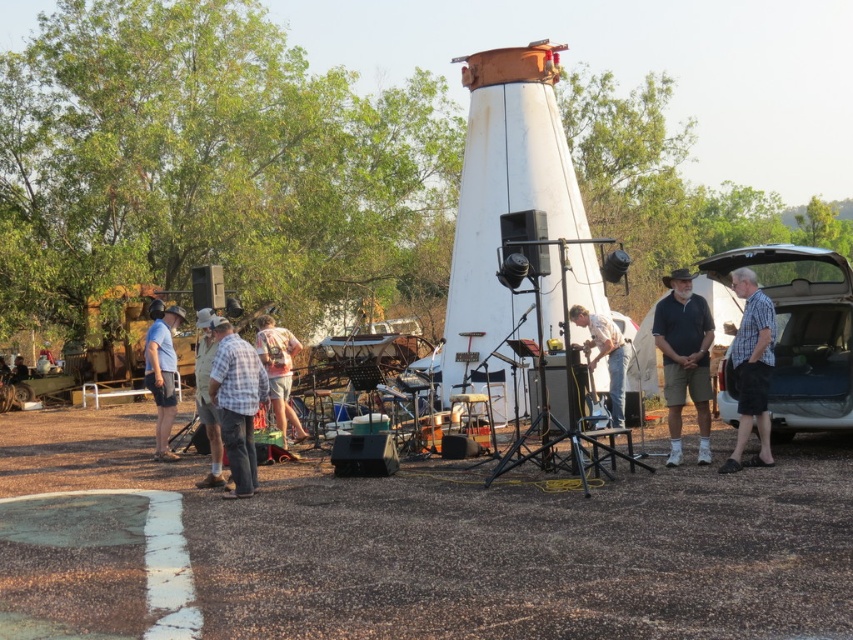
Does point (708, 360) come behind point (285, 420)?

No, it is in front of (285, 420).

Is point (664, 314) in front of point (279, 358)?

Yes.

Identify the location of matte black shirt at center. (683, 358).

Looking at this image, can you confirm if matte black shirt at center is positioned to the left of checkered fabric shirt at right?

Correct, you'll find matte black shirt at center to the left of checkered fabric shirt at right.

Is matte black shirt at center smaller than checkered fabric shirt at right?

Indeed, matte black shirt at center has a smaller size compared to checkered fabric shirt at right.

Between point (699, 365) and point (755, 401), which one is positioned in front?

Point (755, 401) is in front.

Where is `matte black shirt at center`? This screenshot has height=640, width=853. matte black shirt at center is located at coordinates (683, 358).

Between checkered fabric shirt at right and plaid shirt at center, which one has less height?

With less height is plaid shirt at center.

Which is above, checkered fabric shirt at right or plaid shirt at center?

checkered fabric shirt at right

Who is more distant from viewer, (757, 454) or (238, 358)?

The point (757, 454) is behind.

Locate an element on the screen. checkered fabric shirt at right is located at coordinates (751, 369).